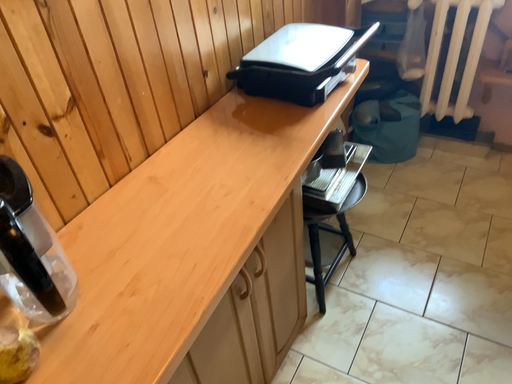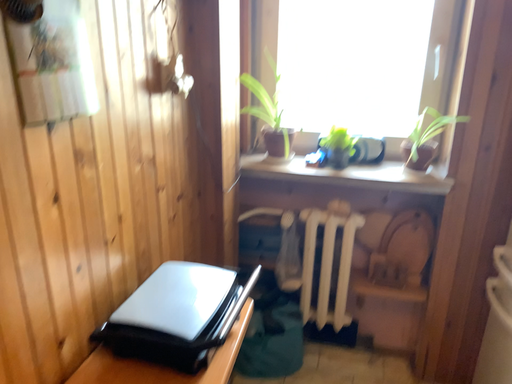
Question: Which way did the camera rotate in the video?

Choices:
 (A) rotated left
 (B) rotated right

Answer: (B)